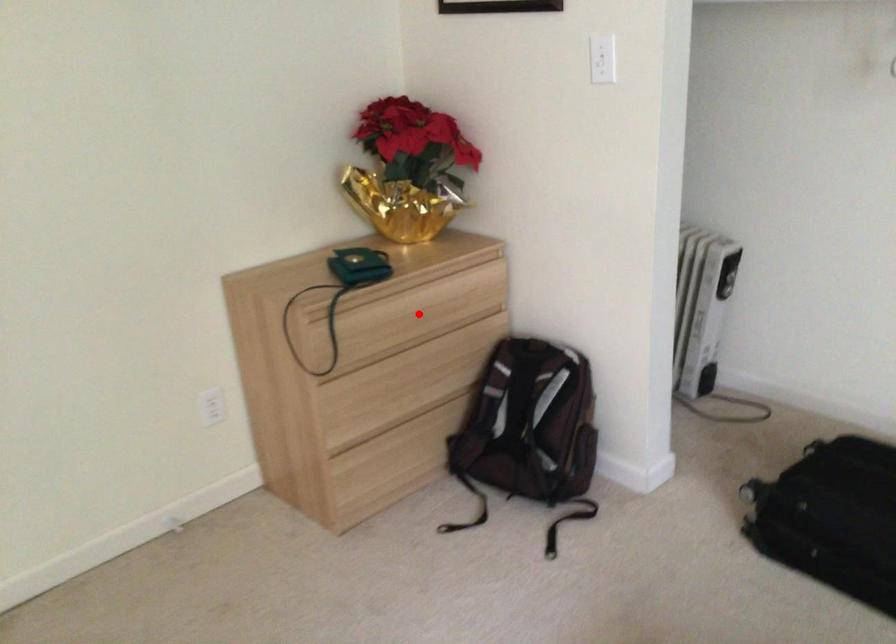
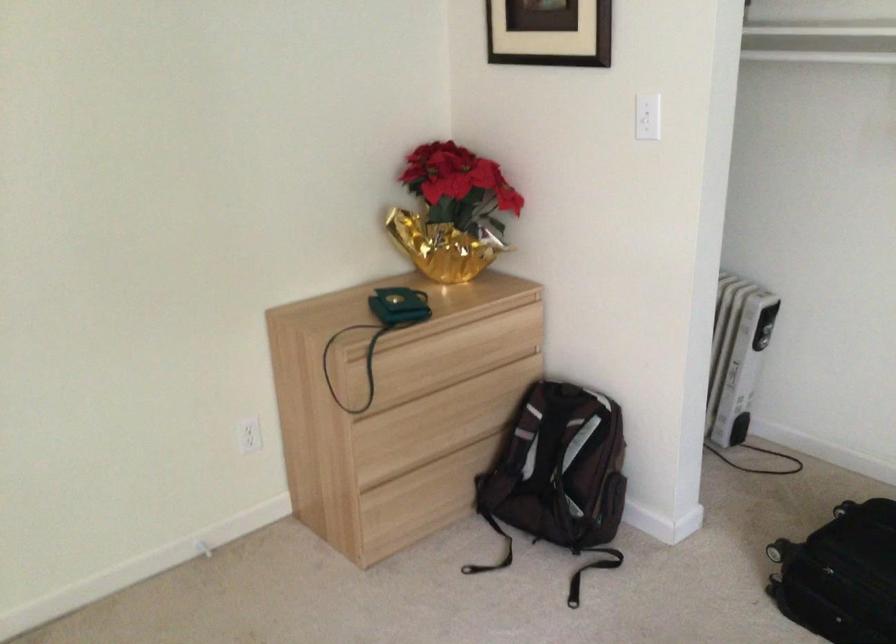
Find the pixel in the second image that matches the highlighted location in the first image.

(454, 355)